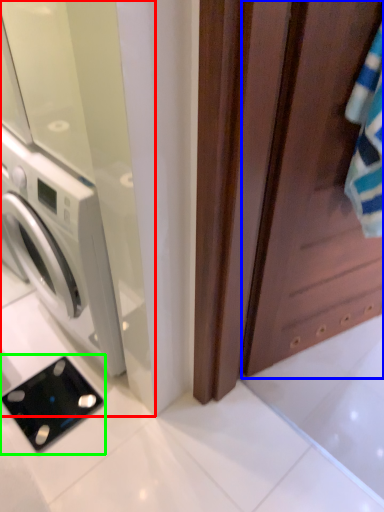
Question: Which object is positioned farthest from screen door (highlighted by a red box)? Select from screen door (highlighted by a blue box) and appliance (highlighted by a green box).

Choices:
 (A) screen door
 (B) appliance

Answer: (B)